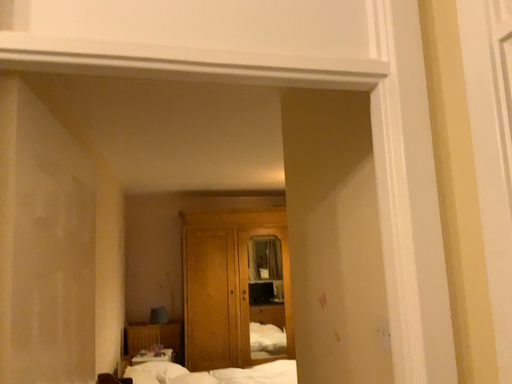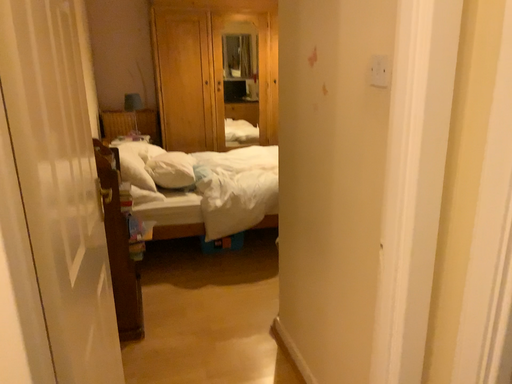
Question: How did the camera likely rotate when shooting the video?

Choices:
 (A) rotated downward
 (B) rotated upward

Answer: (A)